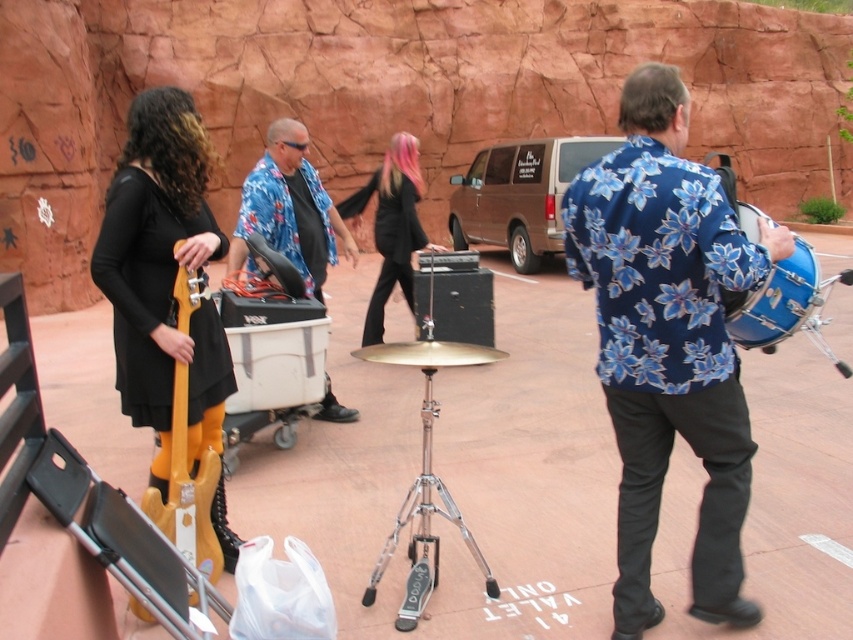
Between black glossy guitar at center and blue metallic drum at right, which one is positioned higher?

black glossy guitar at center is above.

Describe the element at coordinates (392, 225) in the screenshot. I see `black glossy guitar at center` at that location.

Locate an element on the screen. This screenshot has width=853, height=640. black glossy guitar at center is located at coordinates (392, 225).

Describe the element at coordinates (668, 340) in the screenshot. The height and width of the screenshot is (640, 853). I see `blue floral shirt at center` at that location.

Does point (755, 614) come behind point (184, 449)?

That is False.

Does point (730, 285) lie behind point (180, 476)?

No, it is in front of (180, 476).

This screenshot has width=853, height=640. Identify the location of blue floral shirt at center. (668, 340).

Which is behind, point (628, 576) or point (799, 321)?

The point (799, 321) is behind.

Which of these two, blue floral shirt at center or blue metallic drum at right, stands taller?

blue floral shirt at center

This screenshot has width=853, height=640. Describe the element at coordinates (668, 340) in the screenshot. I see `blue floral shirt at center` at that location.

Find the location of `blue floral shirt at center`. blue floral shirt at center is located at coordinates (668, 340).